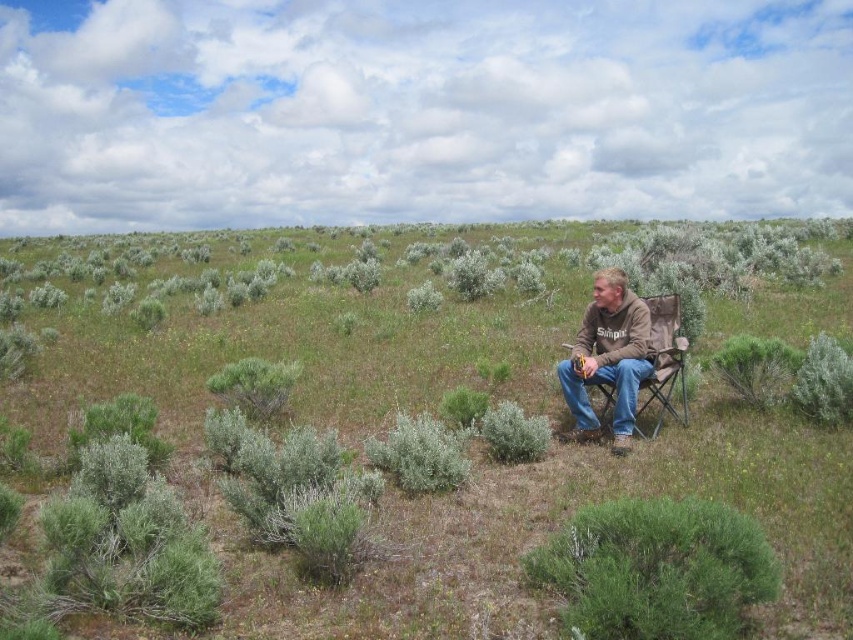
Does green fuzzy bush at lower right lie behind brown cotton shirt at center?

No, it is in front of brown cotton shirt at center.

Which is above, green fuzzy bush at lower right or brown cotton shirt at center?

brown cotton shirt at center is above.

Is point (585, 563) less distant than point (613, 449)?

Yes, point (585, 563) is in front of point (613, 449).

In order to click on green fuzzy bush at lower right in this screenshot , I will do `click(657, 570)`.